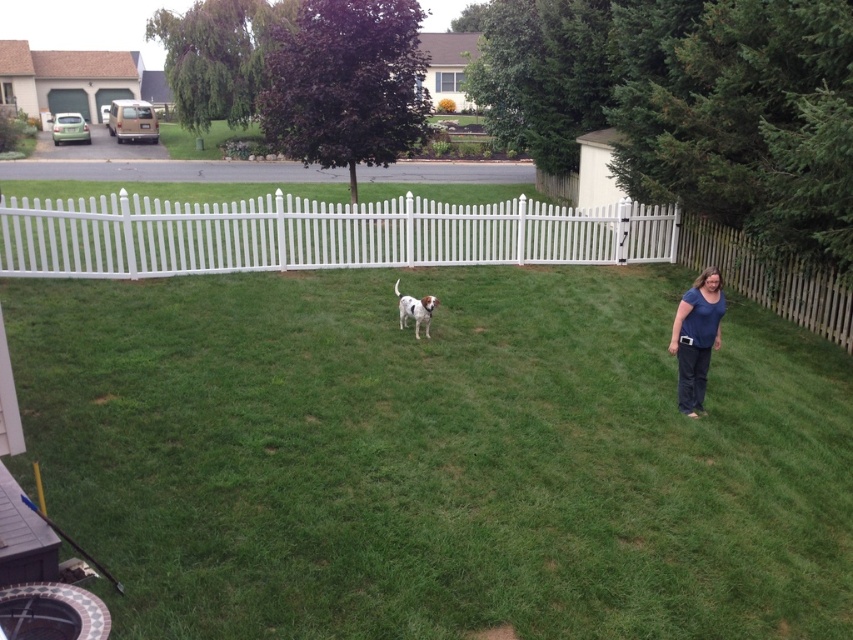
You are standing at the center of the grassy lawn and want to take a photo of the white plastic picket fence at center. Which direction should you face to ensure the fence is in the frame?

You should face towards the center of the grassy lawn to ensure the white plastic picket fence at center is in the frame.

You are a photographer trying to capture a clear shot of the white plastic picket fence at center and the white speckled fur dog at center. Based on their positions, which object is closer to the camera?

The white plastic picket fence at center is located above the white speckled fur dog at center, which means it is closer to the camera.

The woman is standing on the right side of the frame holding a camera. She wants to take a photo of the small dog in the center of the lawn. The white plastic picket fence at center is represented by point (316, 234). Can she take the photo without the fence blocking the dog?

The white plastic picket fence at center is located at point (316, 234). Since the dog is in the center of the lawn and the fence is also at the center, the fence may block the dog in the photo unless the woman adjusts her position or angle.